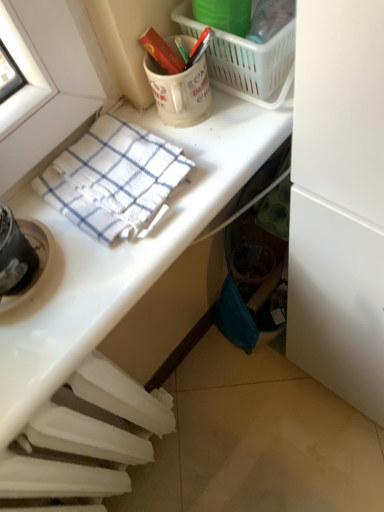
What are the coordinates of `vacant area that lies between white checkered towel at upper left and white matte coffee cup at upper center` in the screenshot? It's located at (180, 131).